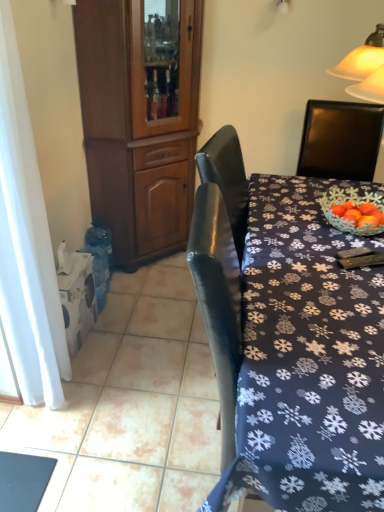
Locate an element on the screen. This screenshot has width=384, height=512. free spot in front of brown wood cabinet at left is located at coordinates (144, 316).